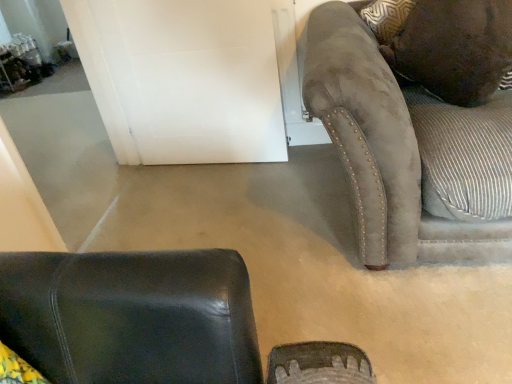
Locate an element on the screen. This screenshot has height=384, width=512. vacant point to the left of white matte door at upper center is located at coordinates click(x=157, y=187).